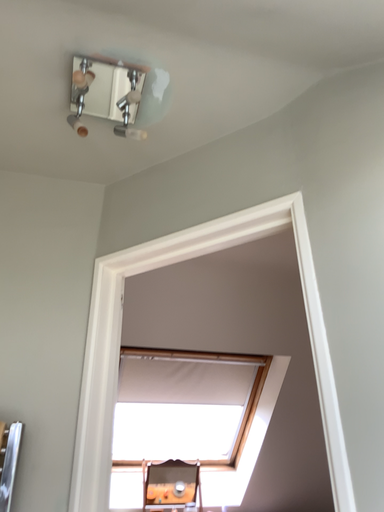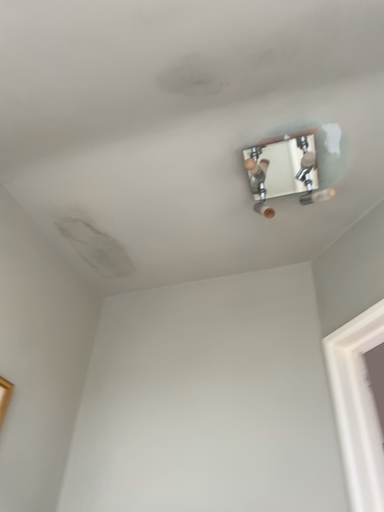
Question: Which way did the camera rotate in the video?

Choices:
 (A) rotated right
 (B) rotated left

Answer: (B)